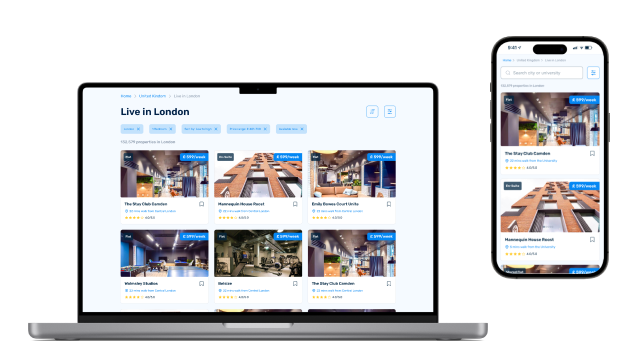
Where is `large windows`? This screenshot has height=364, width=636. large windows is located at coordinates (258, 189), (293, 187).